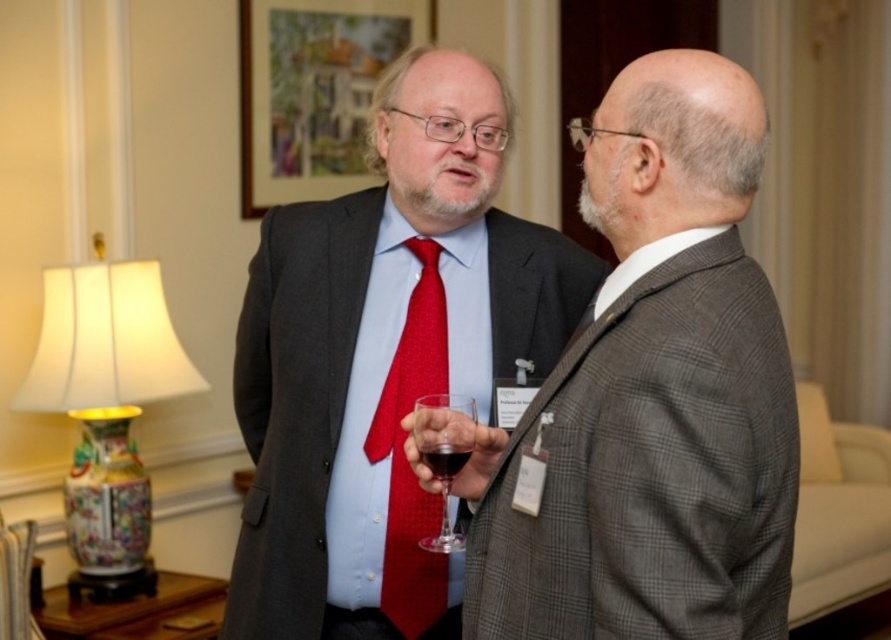
Question: Which of these objects is positioned farthest from the transparent glass at center?

Choices:
 (A) red textured tie at center
 (B) matte gray suit at center
 (C) dark red liquid at center
 (D) matte black suit at center

Answer: (D)

Question: Does transparent glass at center have a lesser width compared to dark red liquid at center?

Choices:
 (A) no
 (B) yes

Answer: (A)

Question: Among these points, which one is nearest to the camera?

Choices:
 (A) (569, 406)
 (B) (391, 148)
 (C) (436, 376)

Answer: (A)

Question: Based on their relative distances, which object is farther from the matte gray suit at center?

Choices:
 (A) matte black suit at center
 (B) porcelain vase at left

Answer: (B)

Question: Is matte gray suit at center positioned behind porcelain vase at left?

Choices:
 (A) yes
 (B) no

Answer: (B)

Question: Is matte black suit at center to the left of red textured tie at center from the viewer's perspective?

Choices:
 (A) no
 (B) yes

Answer: (B)